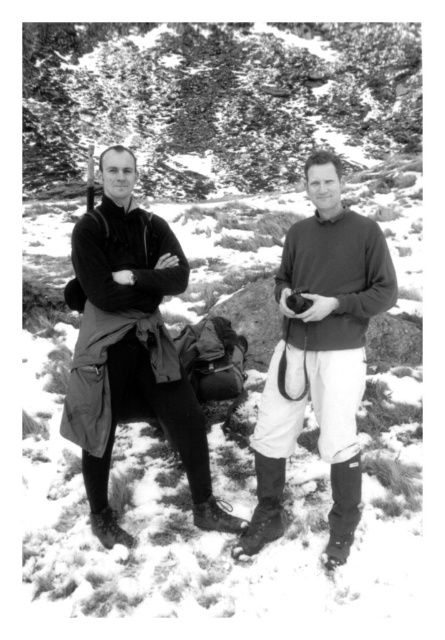
You are a hiker trying to locate your two companions in a snowy mountain area. You remember that one is wearing a matte black jacket at center and the other is wearing a matte brown sweater at center. According to the scene, which companion is positioned to the right?

The matte brown sweater at center is to the right of the matte black jacket at center.

You are trying to determine which piece of clothing is narrower between the matte black jacket at center and the matte brown sweater at center. Which one should you choose?

The matte black jacket at center is narrower than the matte brown sweater at center, so you should choose the matte black jacket at center.

You are navigating a snowy mountain trail and need to locate your gear. Which object from the scene corresponds to the matte black jacket at center, and where is it positioned relative to your current viewpoint?

The matte black jacket at center is positioned at coordinates point (320, 355), which places it centrally in the image from your viewpoint.